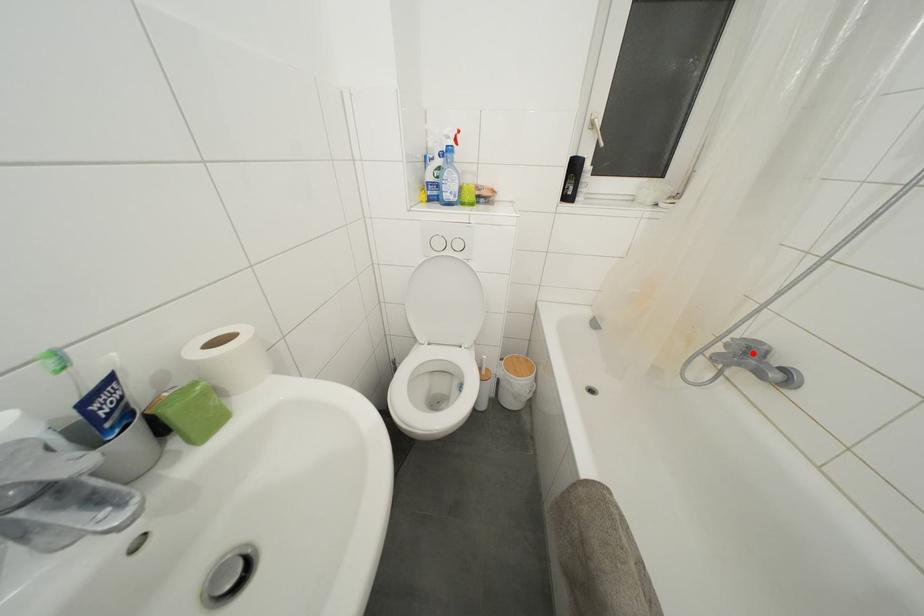
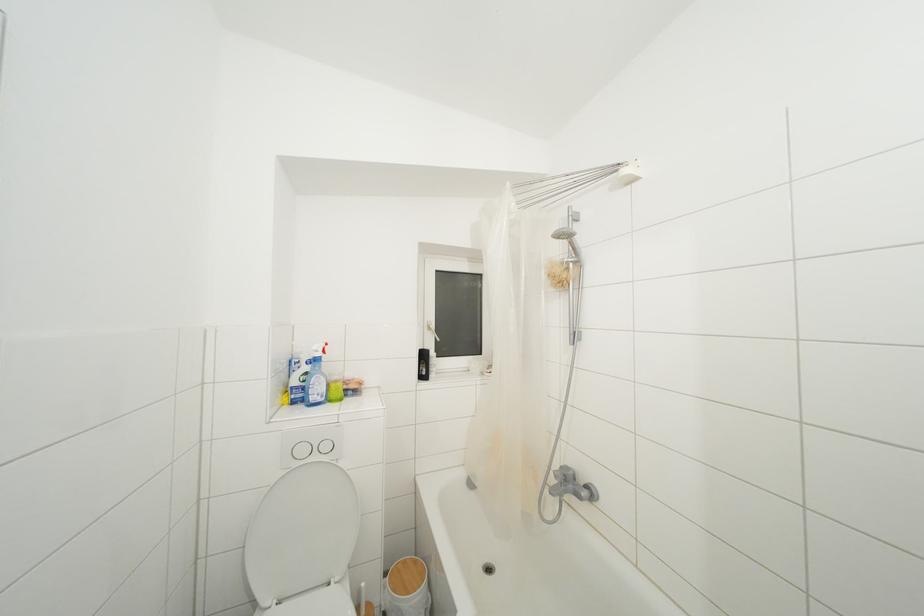
The point at the highlighted location is marked in the first image. Where is the corresponding point in the second image?

(568, 480)